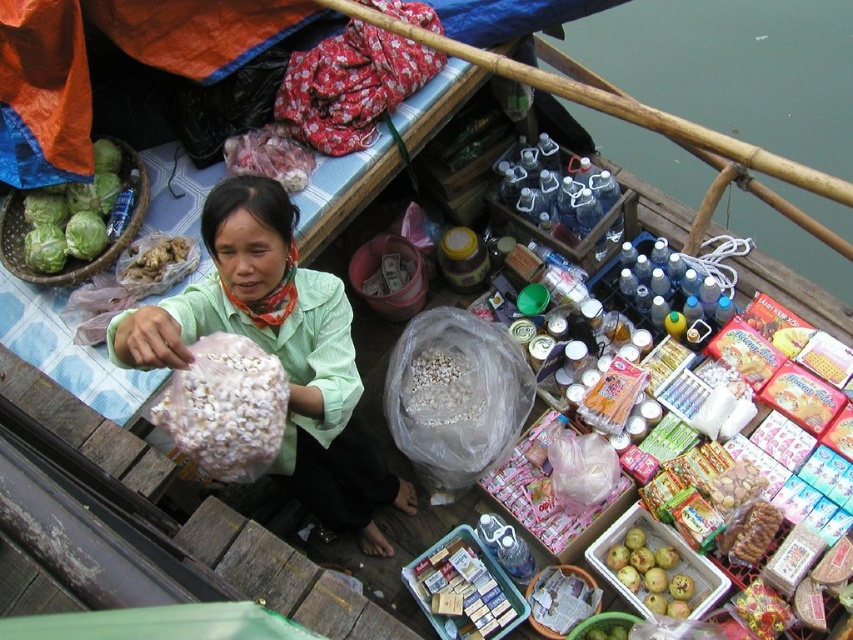
What is located at the coordinates point (440,387) on the image?

The point (440,387) is on white matte popcorn at center.

You are a customer at the floating market and want to buy both the white matte popcorn at center and the brown crumbly ginger at center. If you have a small bag that can only hold items narrower than the ginger, which item can you purchase first?

The brown crumbly ginger at center is narrower than the white matte popcorn at center, so you can purchase the brown crumbly ginger at center first as it fits in the small bag.